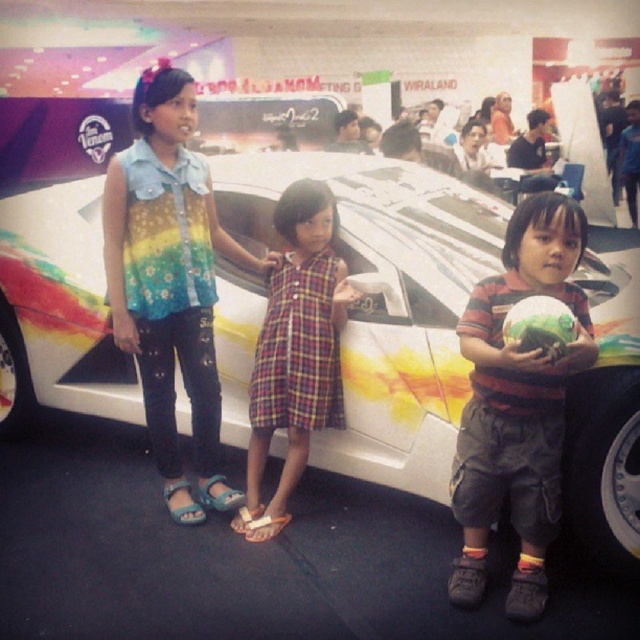
Is white glossy car at center in front of striped cotton shirt at center?

No.

Can you confirm if white glossy car at center is thinner than striped cotton shirt at center?

No.

This screenshot has width=640, height=640. What are the coordinates of `white glossy car at center` in the screenshot? It's located at (385, 300).

What do you see at coordinates (385, 300) in the screenshot? I see `white glossy car at center` at bounding box center [385, 300].

Who is more distant from viewer, [230,225] or [321,296]?

Positioned behind is point [230,225].

The width and height of the screenshot is (640, 640). I want to click on white glossy car at center, so click(x=385, y=300).

Does striped cotton shirt at center have a lesser height compared to plaid fabric dress at center?

Yes, striped cotton shirt at center is shorter than plaid fabric dress at center.

From the picture: Which of these two, striped cotton shirt at center or plaid fabric dress at center, stands taller?

With more height is plaid fabric dress at center.

Is point (474, 362) closer to camera compared to point (292, 248)?

Yes, it is in front of point (292, 248).

Where is `striped cotton shirt at center`? This screenshot has width=640, height=640. striped cotton shirt at center is located at coordinates (516, 404).